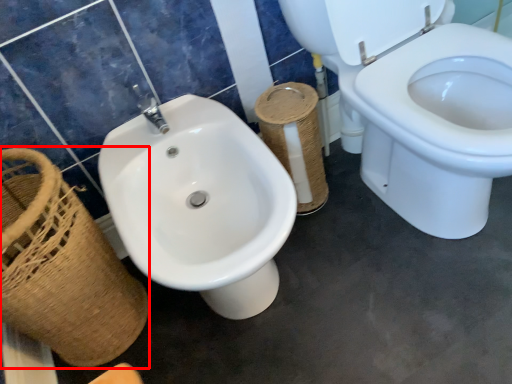
Question: Observing the image, what is the correct spatial positioning of basket (annotated by the red box) in reference to toilet paper?

Choices:
 (A) left
 (B) right

Answer: (A)